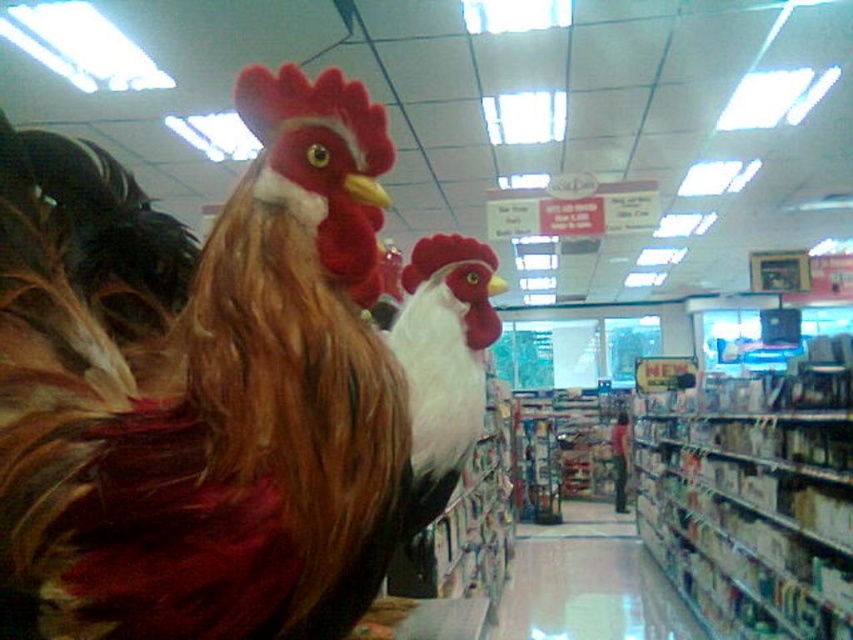
You are a customer in the grocery store and want to find the white matte rooster at center. According to the store map, the point where you are standing is at coordinates (x=444, y=360). Can you see the white matte rooster at center from your current position?

The white matte rooster at center is located exactly at your current coordinates (x=444, y=360), so you are standing right where it is placed. You should be able to see it directly beneath or in front of you.

You are a delivery person who needs to move a package from the matte brown rooster at left to the white cardboard boxes at center. Given that your cart can only move in straight lines and has a maximum turning radius of 5 feet, will you be able to navigate the path between them without turning?

The distance between the matte brown rooster at left and the white cardboard boxes at center is 9.45 feet. Since the cart can move in straight lines and the path is a straight line between them, there is no need to turn. Therefore, the cart can navigate the path without turning as long as there are no obstacles in between.

You are a delivery person carrying a large box that measures 5 meters in length. You need to navigate through the grocery store aisle where you see the white matte rooster at center and the white glossy aisle at center. Can you safely pass through the space between them without hitting the box against either object?

The distance between the white matte rooster at center and the white glossy aisle at center is 4.93 meters. Since your box is 5 meters long, it will not fit through the space, so you cannot safely pass without hitting the box against either object.